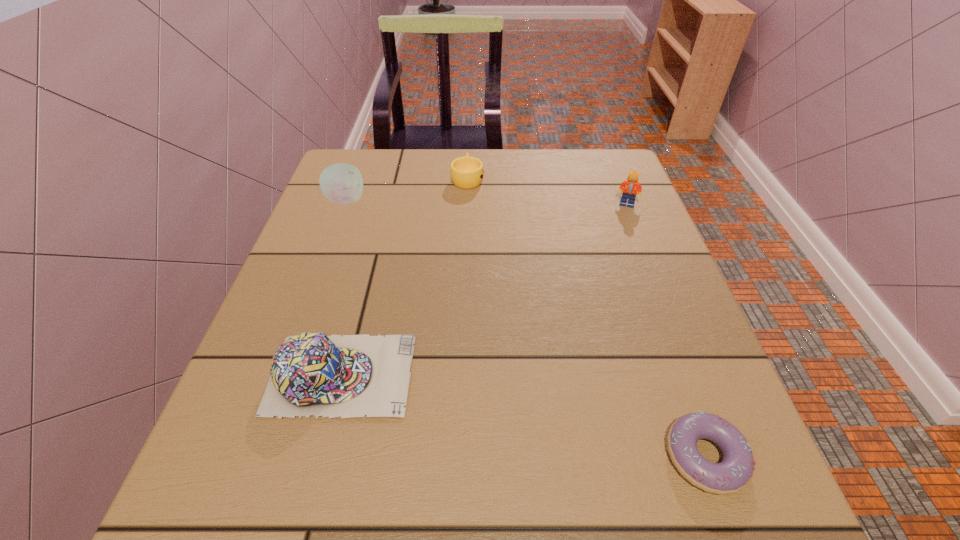
Identify the location of apple. (342, 183).

Locate an element on the screen. This screenshot has width=960, height=540. Lego is located at coordinates (630, 186).

What are the coordinates of `the third shortest object` in the screenshot? It's located at [311, 374].

In order to click on the second shortest object in this screenshot , I will do `click(467, 172)`.

Where is `cup`? This screenshot has height=540, width=960. cup is located at coordinates (467, 172).

Identify the location of the shortest object. The width and height of the screenshot is (960, 540). (735, 471).

The height and width of the screenshot is (540, 960). In order to click on free space located on the right of the apple in this screenshot , I will do `click(386, 200)`.

Find the location of `vacant area situated 0.380m on the front-facing side of the Lego`. vacant area situated 0.380m on the front-facing side of the Lego is located at coordinates (679, 336).

Where is `free space located on the front, side, and top of the third tallest object`? free space located on the front, side, and top of the third tallest object is located at coordinates coord(557,374).

Locate an element on the screen. Image resolution: width=960 pixels, height=540 pixels. free point located on the front of the third object from left to right is located at coordinates (466, 229).